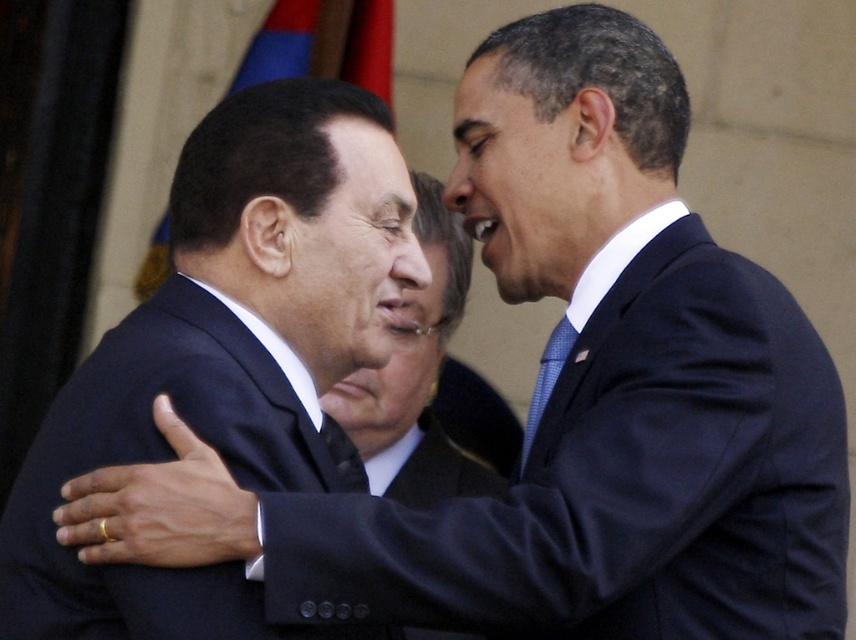
Who is lower down, dark blue suit at left or matte black suit at center?

dark blue suit at left is lower down.

Measure the distance between point (263, 474) and camera.

Point (263, 474) and camera are 20.15 feet apart.

The image size is (856, 640). I want to click on dark blue suit at left, so click(x=159, y=461).

Measure the distance between dark blue suit at left and blue textured tie at right.

dark blue suit at left and blue textured tie at right are 5.09 feet apart.

Can you confirm if dark blue suit at left is shorter than blue textured tie at right?

No, dark blue suit at left is not shorter than blue textured tie at right.

Who is more forward, [183,406] or [547,346]?

Point [183,406] is more forward.

Locate an element on the screen. This screenshot has width=856, height=640. dark blue suit at left is located at coordinates (159, 461).

Which is in front, point (357, 438) or point (522, 435)?

Point (357, 438) is in front.

From the picture: Who is shorter, matte black suit at center or blue textured tie at right?

blue textured tie at right is shorter.

Does point (489, 476) come in front of point (560, 328)?

No.

This screenshot has width=856, height=640. What are the coordinates of `matte black suit at center` in the screenshot? It's located at (421, 380).